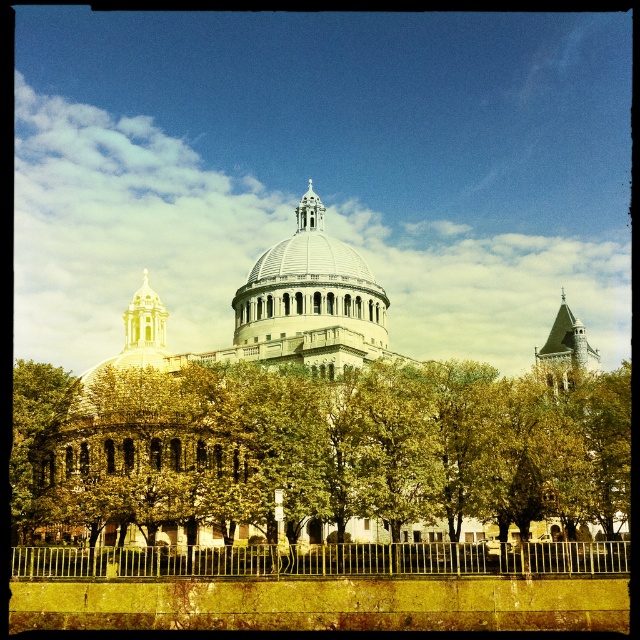
Question: Which object is the farthest from the gold metallic fence at lower center?

Choices:
 (A) green leafy tree at center
 (B) white marble dome at center

Answer: (B)

Question: Which object is farther from the camera taking this photo?

Choices:
 (A) gold metallic fence at lower center
 (B) green leafy tree at center
 (C) white marble dome at center

Answer: (C)

Question: Which of the following is the farthest from the observer?

Choices:
 (A) (45, 572)
 (B) (296, 292)

Answer: (B)

Question: Can you confirm if gold metallic fence at lower center is positioned to the right of white marble dome at center?

Choices:
 (A) yes
 (B) no

Answer: (A)

Question: Does green leafy tree at center have a lesser width compared to white marble dome at center?

Choices:
 (A) yes
 (B) no

Answer: (B)

Question: Is gold metallic fence at lower center wider than white marble dome at center?

Choices:
 (A) yes
 (B) no

Answer: (A)